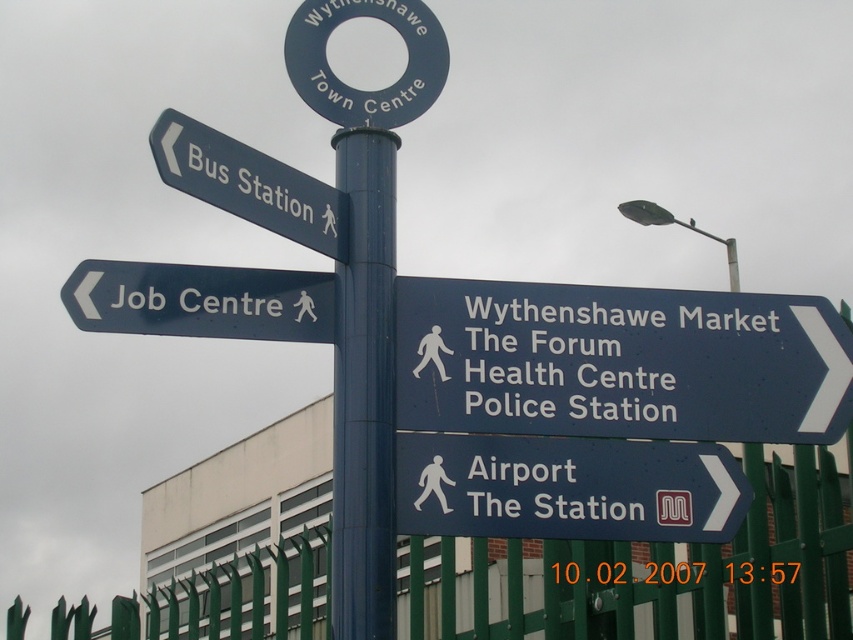
Between green metal fence at lower right and blue plastic sign at lower center, which one is positioned lower?

green metal fence at lower right

Is green metal fence at lower right bigger than blue plastic sign at lower center?

Yes, green metal fence at lower right is bigger than blue plastic sign at lower center.

Between point (234, 628) and point (572, 472), which one is positioned behind?

Positioned behind is point (234, 628).

The width and height of the screenshot is (853, 640). Identify the location of green metal fence at lower right. (671, 572).

Can you confirm if blue metallic sign at center right is positioned to the right of green metal fence at lower right?

Correct, you'll find blue metallic sign at center right to the right of green metal fence at lower right.

Based on the photo, is blue metallic sign at center right positioned behind green metal fence at lower right?

Yes.

Identify the location of blue metallic sign at center right. Image resolution: width=853 pixels, height=640 pixels. (619, 362).

What do you see at coordinates (619, 362) in the screenshot?
I see `blue metallic sign at center right` at bounding box center [619, 362].

Is blue metallic sign at center right above matte black sign at left?

Incorrect, blue metallic sign at center right is not positioned above matte black sign at left.

Who is more forward, (x=604, y=417) or (x=134, y=323)?

Point (x=134, y=323) is in front.

Where is `blue metallic sign at center right`? The width and height of the screenshot is (853, 640). blue metallic sign at center right is located at coordinates (619, 362).